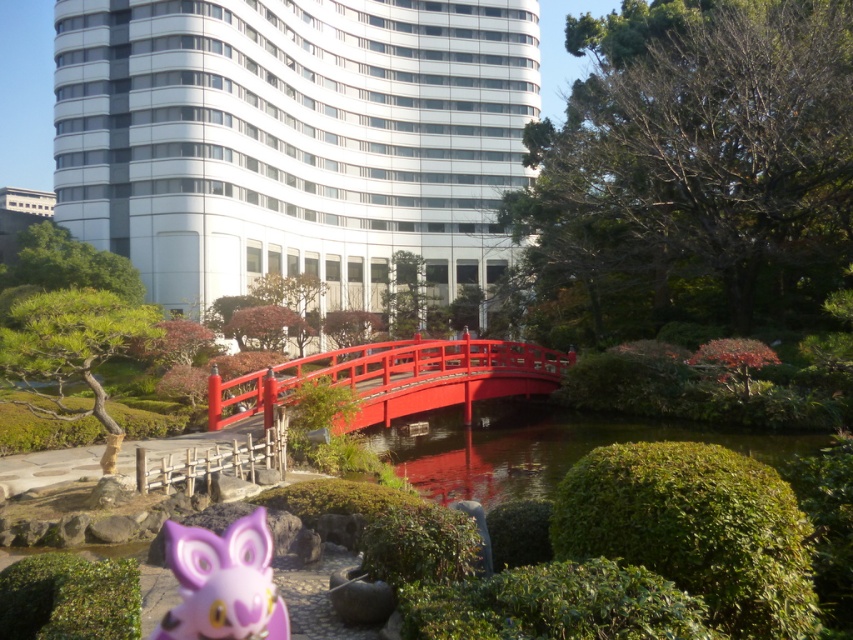
Question: Which object is positioned farthest from the purple matte plush toy at lower left?

Choices:
 (A) green glossy pond at center
 (B) glossy wood bridge at center

Answer: (B)

Question: Does glossy wood bridge at center have a greater width compared to purple matte plush toy at lower left?

Choices:
 (A) yes
 (B) no

Answer: (A)

Question: Which object is farther from the camera taking this photo?

Choices:
 (A) purple matte plush toy at lower left
 (B) green glossy pond at center
 (C) glossy wood bridge at center

Answer: (C)

Question: Which of the following is the closest to the observer?

Choices:
 (A) (250, 580)
 (B) (357, 387)
 (C) (531, 449)

Answer: (A)

Question: Is glossy wood bridge at center wider than purple matte plush toy at lower left?

Choices:
 (A) no
 (B) yes

Answer: (B)

Question: Is green glossy pond at center thinner than glossy wood bridge at center?

Choices:
 (A) yes
 (B) no

Answer: (B)